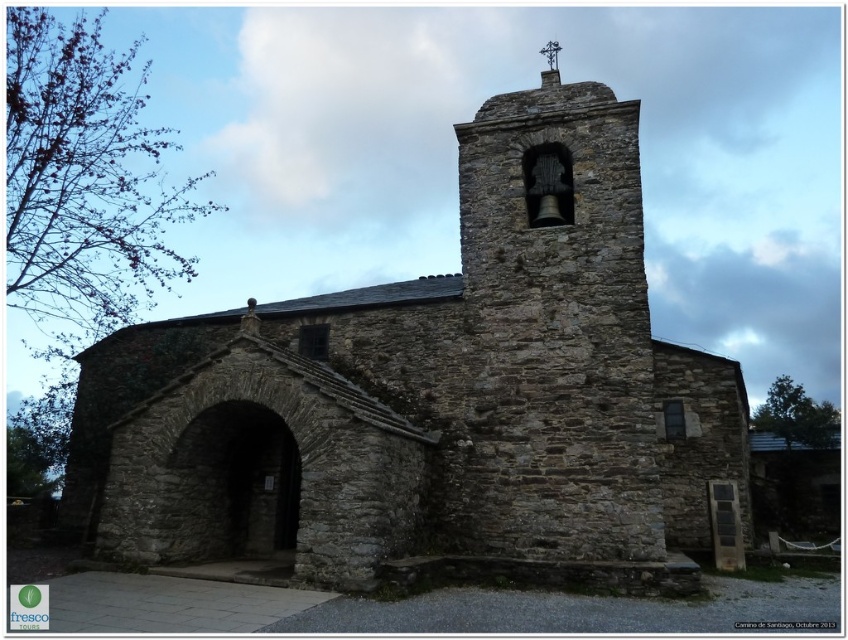
Question: Which point is farther from the camera taking this photo?

Choices:
 (A) (701, 509)
 (B) (545, 480)

Answer: (A)

Question: Among these points, which one is farthest from the camera?

Choices:
 (A) (577, 84)
 (B) (484, 376)

Answer: (A)

Question: Is rustic stone church at center thinner than rustic stone bell tower at center?

Choices:
 (A) yes
 (B) no

Answer: (B)

Question: Does rustic stone church at center have a smaller size compared to rustic stone bell tower at center?

Choices:
 (A) no
 (B) yes

Answer: (A)

Question: Is rustic stone church at center closer to the viewer compared to rustic stone bell tower at center?

Choices:
 (A) yes
 (B) no

Answer: (A)